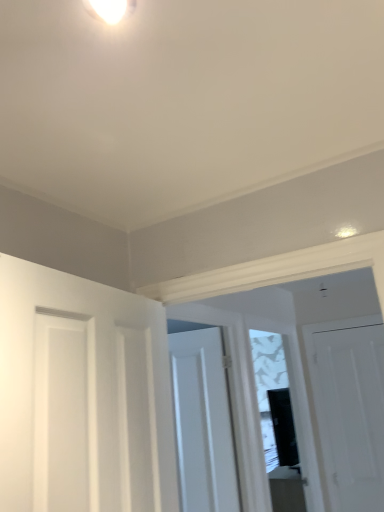
Question: In the image, is white glossy light fixture at upper center on the left side or the right side of white matte door at center, the 2th door viewed from the left?

Choices:
 (A) right
 (B) left

Answer: (B)

Question: Considering their positions, is white glossy light fixture at upper center located in front of or behind white matte door at center, the 2th door viewed from the left?

Choices:
 (A) behind
 (B) front

Answer: (B)

Question: Which is farther from the transparent glass window at center?

Choices:
 (A) white matte door at center, arranged as the 2th door when viewed from the front
 (B) white glossy light fixture at upper center
 (C) white matte door at left, arranged as the 3th door when viewed from the right
 (D) white matte door at right, the 3th door from the left

Answer: (B)

Question: Considering the real-world distances, which object is closest to the white glossy light fixture at upper center?

Choices:
 (A) white matte door at left, arranged as the 3th door when viewed from the right
 (B) transparent glass window at center
 (C) white matte door at right, the 3th door from the left
 (D) white matte door at center, which is counted as the second door, starting from the right

Answer: (A)